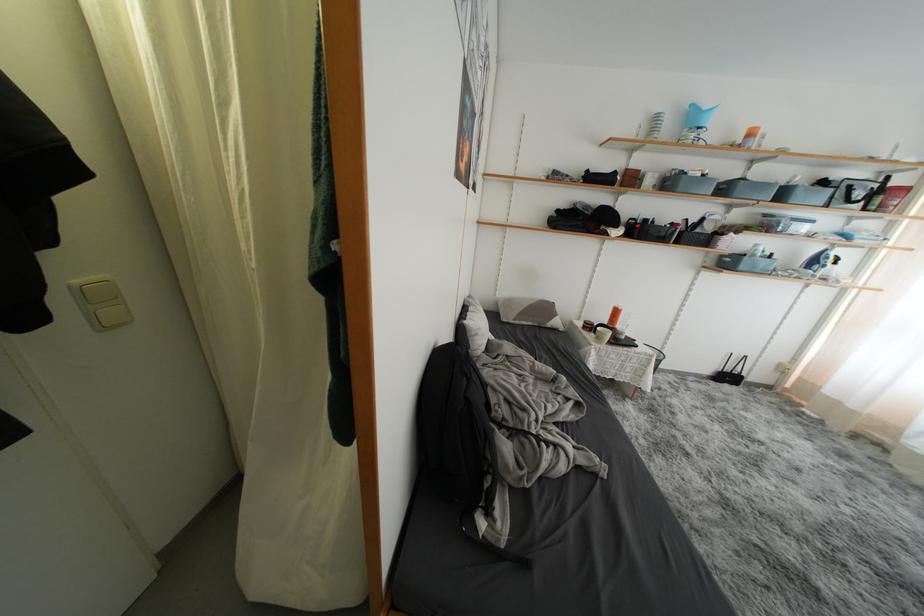
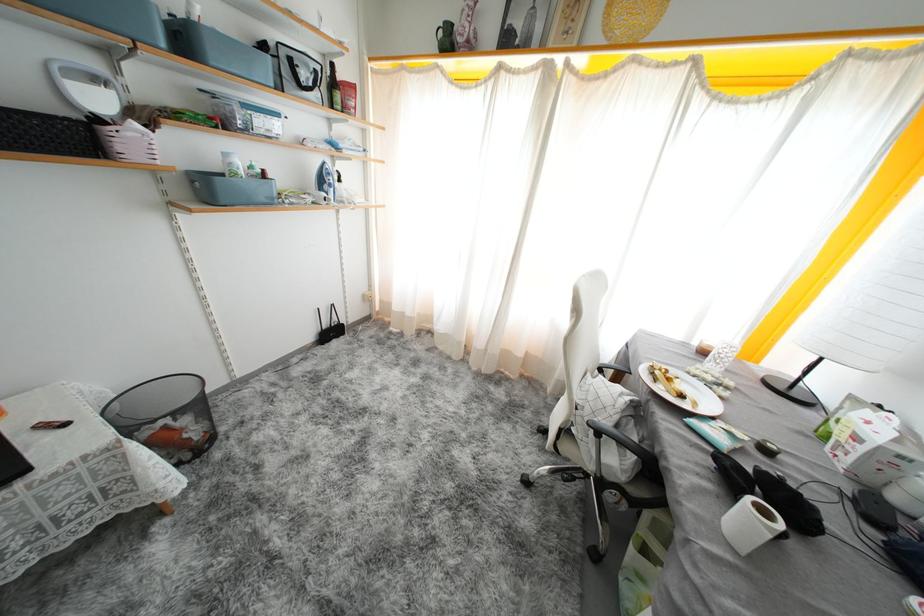
Where in the second image is the point corresponding to (789,199) from the first image?

(190, 44)